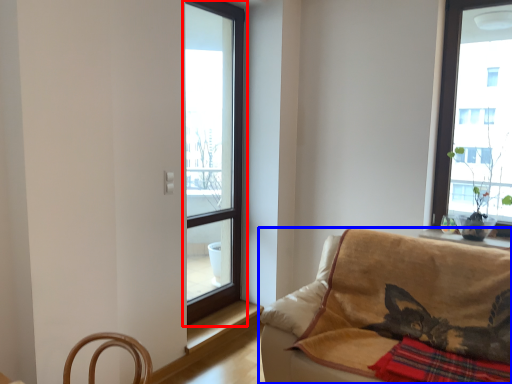
Question: Which object is further to the camera taking this photo, window (highlighted by a red box) or studio couch (highlighted by a blue box)?

Choices:
 (A) window
 (B) studio couch

Answer: (A)